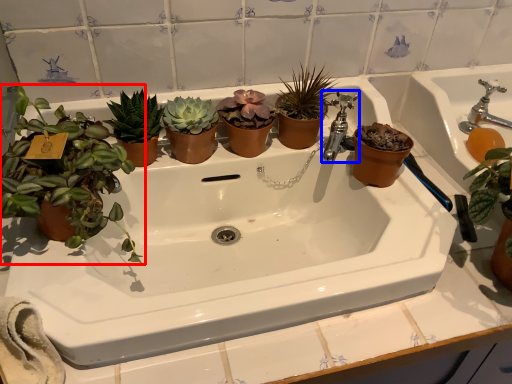
Question: Which object is closer to the camera taking this photo, houseplant (highlighted by a red box) or tap (highlighted by a blue box)?

Choices:
 (A) houseplant
 (B) tap

Answer: (A)